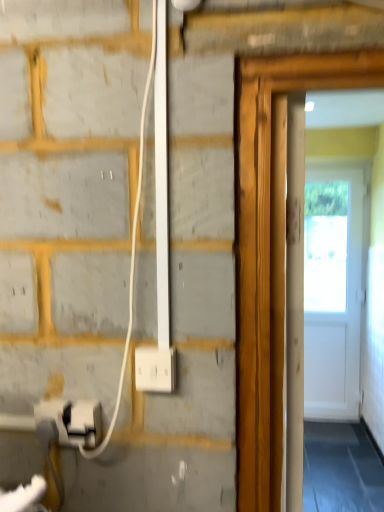
What do you see at coordinates (155, 369) in the screenshot? I see `white plastic socket at lower center` at bounding box center [155, 369].

Identify the location of white plastic socket at lower center. The image size is (384, 512). (155, 369).

This screenshot has width=384, height=512. I want to click on white plastic electric outlet at lower left, so click(73, 421).

What is the approximate width of white plastic electric outlet at lower left?

It is 1.54 inches.

This screenshot has height=512, width=384. Describe the element at coordinates (73, 421) in the screenshot. I see `white plastic electric outlet at lower left` at that location.

This screenshot has width=384, height=512. What are the coordinates of `white plastic socket at lower center` in the screenshot? It's located at (155, 369).

Is white plastic socket at lower center to the right of white plastic electric outlet at lower left from the viewer's perspective?

Correct, you'll find white plastic socket at lower center to the right of white plastic electric outlet at lower left.

Which object is closer to the camera taking this photo, white plastic socket at lower center or white plastic electric outlet at lower left?

white plastic socket at lower center is closer to the camera.

Is point (137, 377) closer to camera compared to point (67, 444)?

Yes.

Looking at this image, from the image's perspective, is white plastic socket at lower center under white plastic electric outlet at lower left?

No.

From a real-world perspective, which object stands above the other?

From a 3D spatial view, white plastic socket at lower center is above.

Considering the sizes of white plastic socket at lower center and white plastic electric outlet at lower left in the image, is white plastic socket at lower center wider or thinner than white plastic electric outlet at lower left?

white plastic socket at lower center is wider than white plastic electric outlet at lower left.

Does white plastic socket at lower center have a lesser height compared to white plastic electric outlet at lower left?

No.

Is white plastic socket at lower center smaller than white plastic electric outlet at lower left?

Actually, white plastic socket at lower center might be larger than white plastic electric outlet at lower left.

Consider the image. Do you think white plastic socket at lower center is within white plastic electric outlet at lower left, or outside of it?

white plastic socket at lower center is spatially situated outside white plastic electric outlet at lower left.

From the picture: Are white plastic socket at lower center and white plastic electric outlet at lower left far apart?

No, white plastic socket at lower center is not far from white plastic electric outlet at lower left.

From the picture: Is white plastic socket at lower center facing towards white plastic electric outlet at lower left?

No, white plastic socket at lower center is not turned towards white plastic electric outlet at lower left.

What's the angular difference between white plastic socket at lower center and white plastic electric outlet at lower left's facing directions?

3.24 degrees.

At what (x,y) coordinates should I click in order to perform the action: click on electric outlet located underneath the white plastic socket at lower center (from a real-world perspective). Please return your answer as a coordinate pair (x, y). This screenshot has width=384, height=512. Looking at the image, I should click on (73, 421).

Is white plastic electric outlet at lower left to the right of white plastic socket at lower center from the viewer's perspective?

No, white plastic electric outlet at lower left is not to the right of white plastic socket at lower center.

Considering their positions, is white plastic electric outlet at lower left located in front of or behind white plastic socket at lower center?

white plastic electric outlet at lower left is positioned farther from the viewer than white plastic socket at lower center.

Is point (92, 420) more distant than point (161, 349)?

Yes.

From the image's perspective, would you say white plastic electric outlet at lower left is shown under white plastic socket at lower center?

Indeed, from the image's perspective, white plastic electric outlet at lower left is shown beneath white plastic socket at lower center.

From a real-world perspective, is white plastic electric outlet at lower left positioned under white plastic socket at lower center based on gravity?

Correct, in the physical world, white plastic electric outlet at lower left is lower than white plastic socket at lower center.

Does white plastic electric outlet at lower left have a greater width compared to white plastic socket at lower center?

In fact, white plastic electric outlet at lower left might be narrower than white plastic socket at lower center.

Between white plastic electric outlet at lower left and white plastic socket at lower center, which one has more height?

Standing taller between the two is white plastic socket at lower center.

Between white plastic electric outlet at lower left and white plastic socket at lower center, which one has larger size?

white plastic socket at lower center is bigger.

Is white plastic electric outlet at lower left outside of white plastic socket at lower center?

Yes, white plastic electric outlet at lower left is located beyond the bounds of white plastic socket at lower center.

Are white plastic electric outlet at lower left and white plastic socket at lower center located far from each other?

white plastic electric outlet at lower left is actually quite close to white plastic socket at lower center.

Is white plastic electric outlet at lower left turned away from white plastic socket at lower center?

No, white plastic electric outlet at lower left is not facing away from white plastic socket at lower center.

Can you tell me how much white plastic electric outlet at lower left and white plastic socket at lower center differ in facing direction?

The facing directions of white plastic electric outlet at lower left and white plastic socket at lower center are 3.24 degrees apart.

How distant is white plastic electric outlet at lower left from white plastic socket at lower center?

white plastic electric outlet at lower left is 6.95 inches away from white plastic socket at lower center.

At what (x,y) coordinates should I click in order to perform the action: click on power plugs and sockets on the right of white plastic electric outlet at lower left. Please return your answer as a coordinate pair (x, y). The height and width of the screenshot is (512, 384). Looking at the image, I should click on (155, 369).

This screenshot has height=512, width=384. In order to click on power plugs and sockets in front of the white plastic electric outlet at lower left in this screenshot , I will do `click(155, 369)`.

At what (x,y) coordinates should I click in order to perform the action: click on power plugs and sockets above the white plastic electric outlet at lower left (from a real-world perspective). Please return your answer as a coordinate pair (x, y). The height and width of the screenshot is (512, 384). Looking at the image, I should click on (155, 369).